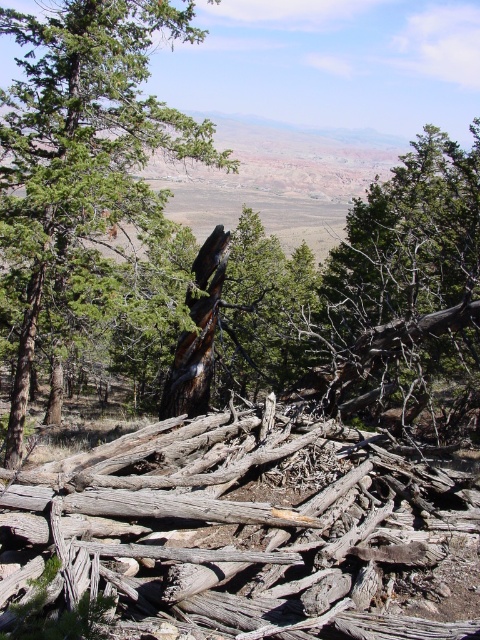
Does weathered wood at center appear under dark brown wood at center?

Indeed, weathered wood at center is positioned under dark brown wood at center.

Is weathered wood at center to the left of dark brown wood at center from the viewer's perspective?

No, weathered wood at center is not to the left of dark brown wood at center.

Locate an element on the screen. The height and width of the screenshot is (640, 480). weathered wood at center is located at coordinates (239, 532).

Between weathered wood at center and brown rough tree trunk at center, which one is positioned higher?

brown rough tree trunk at center

The width and height of the screenshot is (480, 640). Describe the element at coordinates (239, 532) in the screenshot. I see `weathered wood at center` at that location.

Locate an element on the screen. The image size is (480, 640). weathered wood at center is located at coordinates (239, 532).

The image size is (480, 640). Describe the element at coordinates (81, 154) in the screenshot. I see `dark brown wood at center` at that location.

Is dark brown wood at center smaller than brown rough tree trunk at center?

No, dark brown wood at center is not smaller than brown rough tree trunk at center.

Locate an element on the screen. dark brown wood at center is located at coordinates (81, 154).